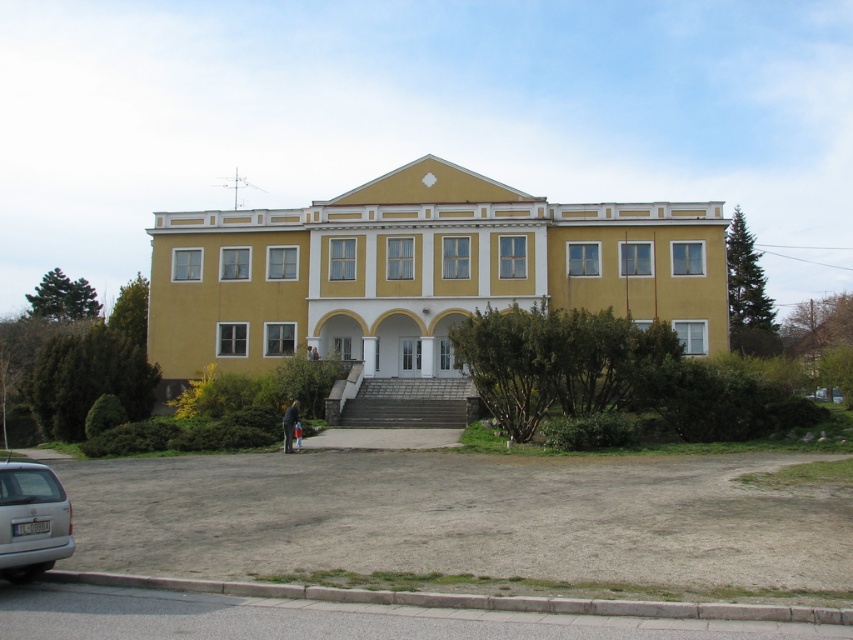
In order to click on yellow matte building at center in this screenshot , I will do `click(418, 273)`.

Is point (190, 346) farther from viewer compared to point (38, 531)?

Yes, it is behind point (38, 531).

Identify the location of yellow matte building at center. (418, 273).